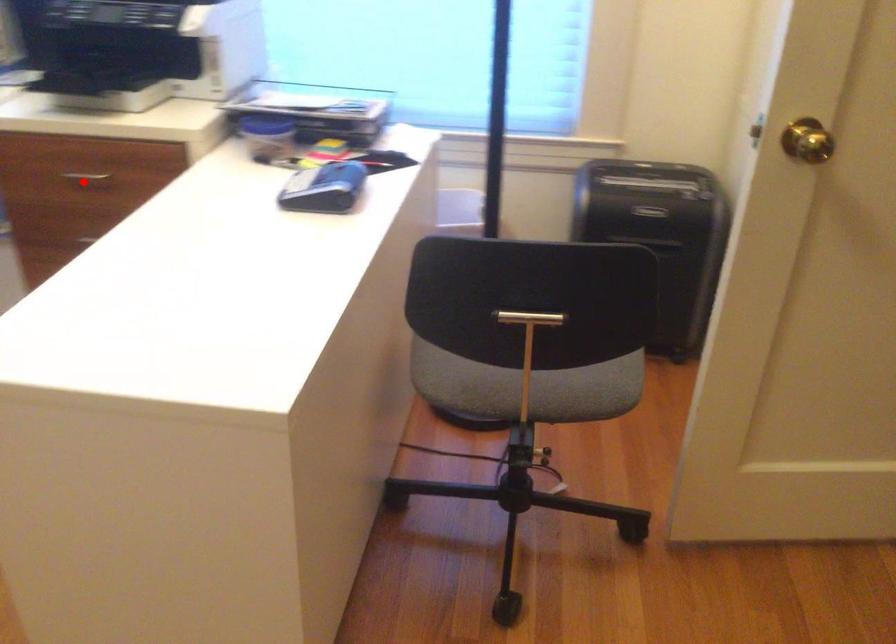
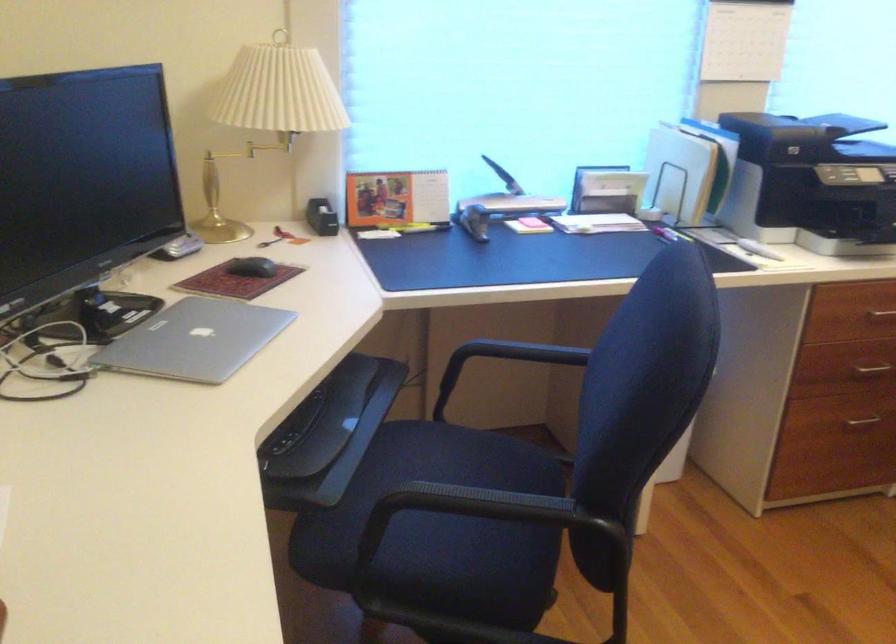
The point at the highlighted location is marked in the first image. Where is the corresponding point in the second image?

(881, 315)